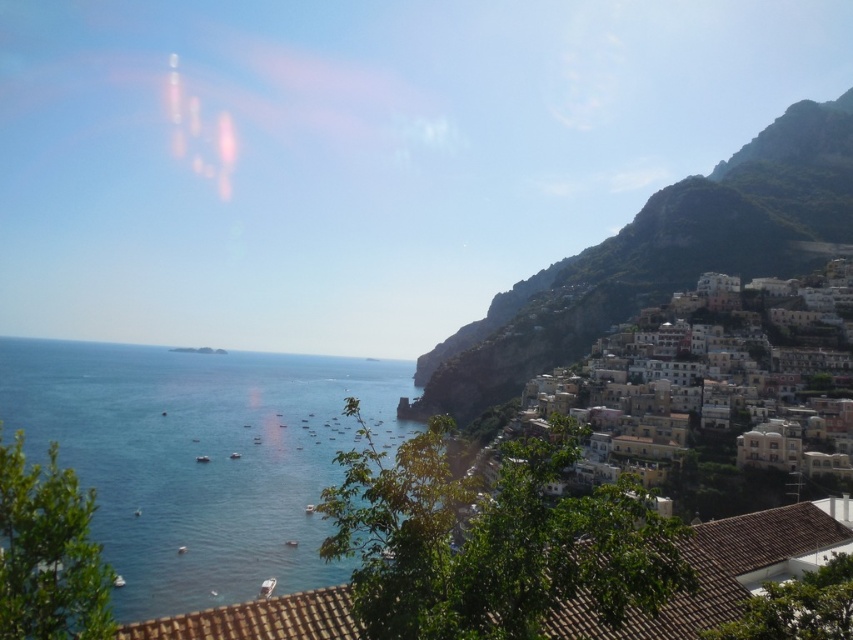
Who is more forward, (15, 422) or (831, 234)?

Positioned in front is point (15, 422).

From the picture: Is blue water at center above rugged rock mountain at right?

Actually, blue water at center is below rugged rock mountain at right.

Between point (234, 588) and point (796, 116), which one is positioned in front?

Point (234, 588) is in front.

I want to click on blue water at center, so click(x=198, y=458).

Is blue water at center further to camera compared to white stucco buildings at right?

No, it is not.

Can you confirm if blue water at center is positioned to the right of white stucco buildings at right?

In fact, blue water at center is to the left of white stucco buildings at right.

Between point (207, 492) and point (651, 340), which one is positioned in front?

Point (207, 492) is more forward.

The image size is (853, 640). What are the coordinates of `blue water at center` in the screenshot? It's located at (198, 458).

Who is taller, rugged rock mountain at right or white stucco buildings at right?

With more height is rugged rock mountain at right.

Does point (534, 353) lie in front of point (752, 362)?

No, it is not.

Which is behind, point (653, 252) or point (845, 339)?

The point (653, 252) is behind.

Locate an element on the screen. Image resolution: width=853 pixels, height=640 pixels. rugged rock mountain at right is located at coordinates (656, 259).